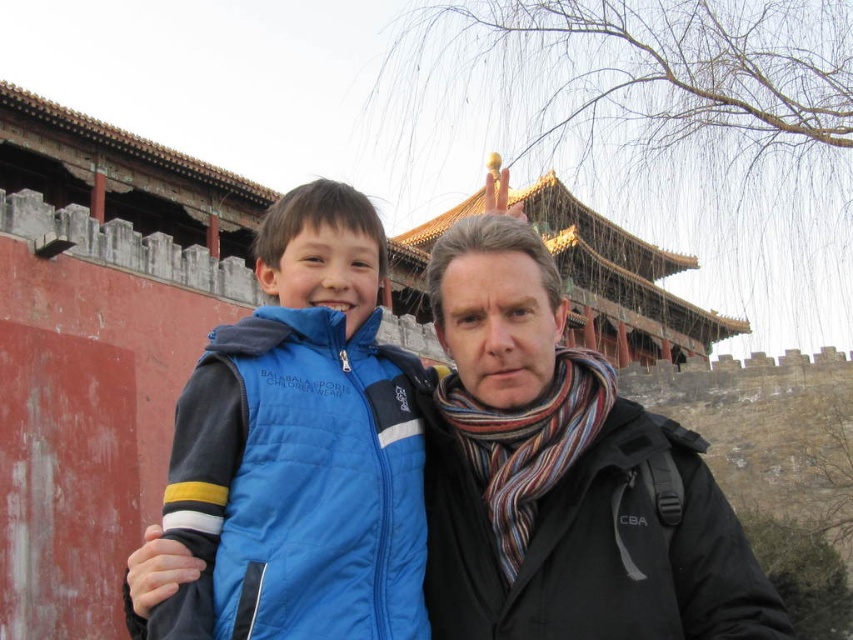
Question: Is matte black jacket at center positioned before blue puffer vest at center?

Choices:
 (A) yes
 (B) no

Answer: (B)

Question: Can you confirm if matte black jacket at center is positioned to the right of blue puffer vest at center?

Choices:
 (A) yes
 (B) no

Answer: (A)

Question: Can you confirm if matte black jacket at center is positioned to the right of blue puffer vest at center?

Choices:
 (A) yes
 (B) no

Answer: (A)